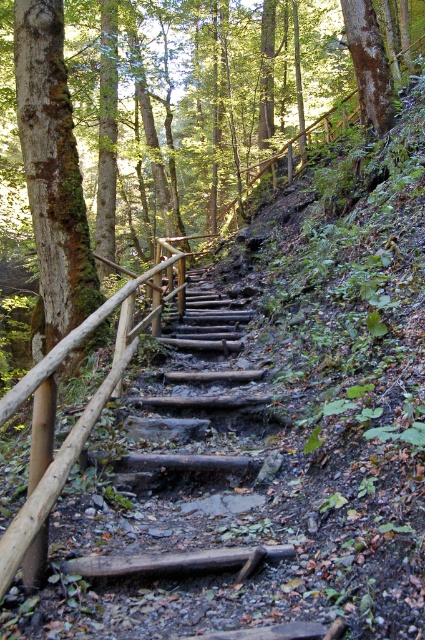
Between rustic wooden stairs at center and brown wooden rail at left, which one appears on the right side from the viewer's perspective?

rustic wooden stairs at center

Is rustic wooden stairs at center bigger than brown wooden rail at left?

Yes, rustic wooden stairs at center is bigger than brown wooden rail at left.

Identify the location of rustic wooden stairs at center. The image size is (425, 640). (206, 339).

Does green mossy bark tree at left appear under rustic wooden stairs at center?

Actually, green mossy bark tree at left is above rustic wooden stairs at center.

Which of these two, green mossy bark tree at left or rustic wooden stairs at center, stands shorter?

rustic wooden stairs at center

Does point (68, 198) come in front of point (238, 456)?

No.

Where is `green mossy bark tree at left`? The height and width of the screenshot is (640, 425). green mossy bark tree at left is located at coordinates (53, 170).

Can you confirm if green mossy bark tree at left is shorter than brown wooden rail at left?

Incorrect, green mossy bark tree at left's height does not fall short of brown wooden rail at left's.

Can you confirm if green mossy bark tree at left is bigger than brown wooden rail at left?

Correct, green mossy bark tree at left is larger in size than brown wooden rail at left.

Which is behind, point (36, 312) or point (132, 342)?

Positioned behind is point (36, 312).

Locate an element on the screen. green mossy bark tree at left is located at coordinates (53, 170).